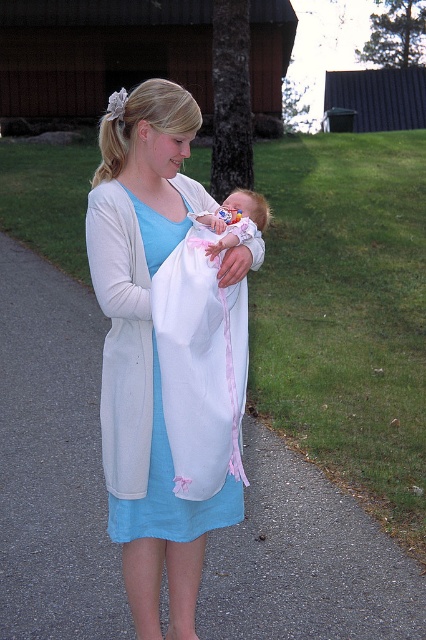
Can you confirm if white cotton dress at center is positioned below pink fabric baby at center?

Correct, white cotton dress at center is located below pink fabric baby at center.

Image resolution: width=426 pixels, height=640 pixels. Find the location of `white cotton dress at center`. white cotton dress at center is located at coordinates (169, 492).